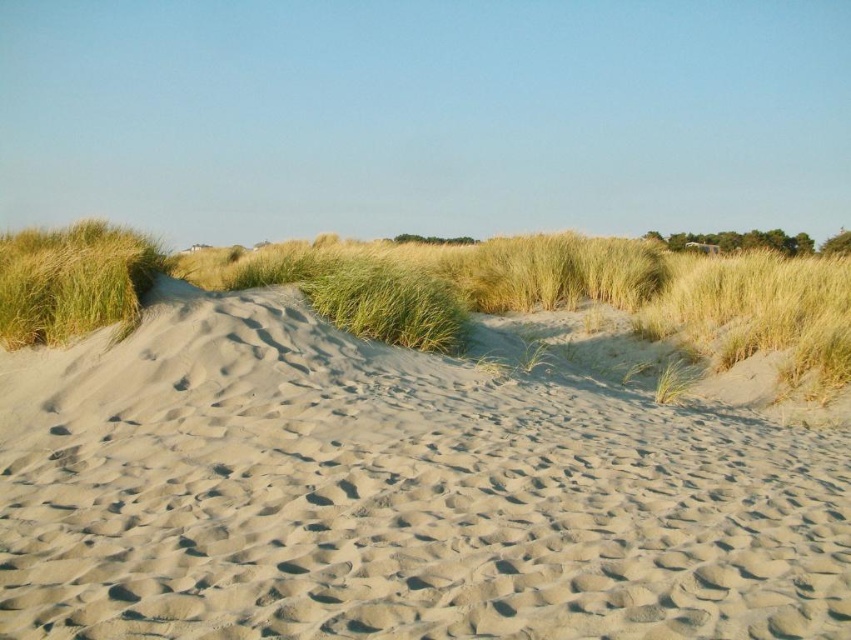
Question: Which object appears farthest from the camera in this image?

Choices:
 (A) smooth sand at center
 (B) green grass at center

Answer: (B)

Question: Does smooth sand at center have a larger size compared to green grass at center?

Choices:
 (A) yes
 (B) no

Answer: (B)

Question: Is smooth sand at center wider than green grassy at left?

Choices:
 (A) yes
 (B) no

Answer: (A)

Question: Does smooth sand at center come in front of green grassy at left?

Choices:
 (A) yes
 (B) no

Answer: (A)

Question: Which point is closer to the camera taking this photo?

Choices:
 (A) (132, 275)
 (B) (592, 499)

Answer: (B)

Question: Which object is closer to the camera taking this photo?

Choices:
 (A) green grass at center
 (B) green grassy at left

Answer: (B)